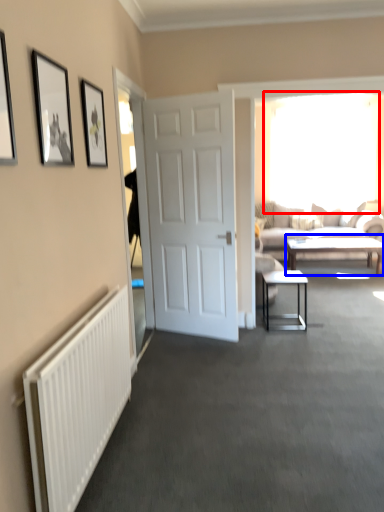
Question: Which object appears closest to the camera in this image, window (highlighted by a red box) or coffee table (highlighted by a blue box)?

Choices:
 (A) window
 (B) coffee table

Answer: (B)